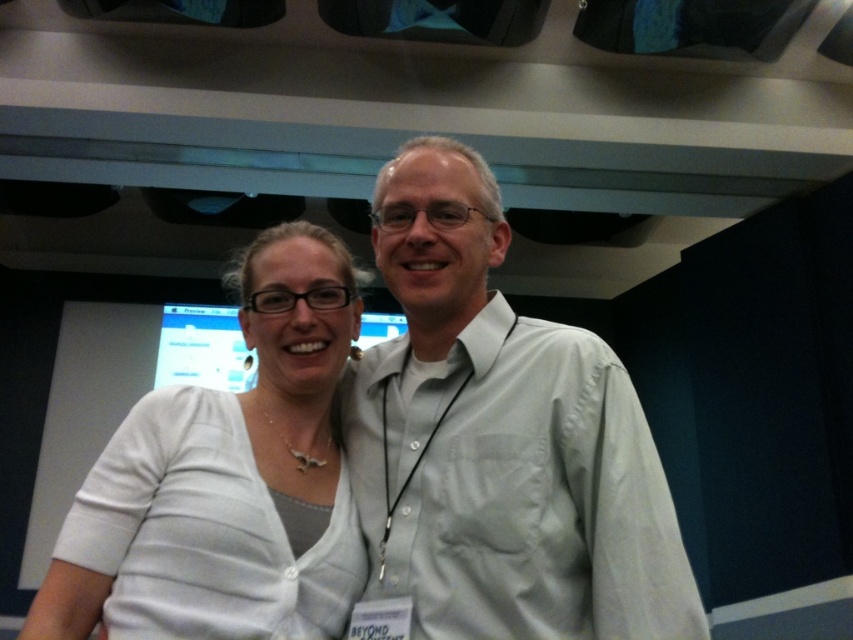
You are at a conference and want to approach the two people in the image. Since you need to speak to the person wearing the light gray shirt at center first, which direction should you move relative to the white matte shirt at center?

The light gray shirt at center is in front of the white matte shirt at center, so you should move forward towards the light gray shirt at center.

You are a photographer at an event and need to capture a photo of both the light gray shirt at center and the white matte shirt at center. The camera has a minimum focus distance of 9 inches. Can you take a photo of both shirts at the same time without moving either?

The light gray shirt at center is 8.91 inches from the white matte shirt at center, which is less than the camera minimum focus distance of 9 inches. Therefore, the camera cannot focus on both shirts simultaneously.

You are standing at the back of the room and want to take a photo of the two people in the image. Which point, point (395, 529) or point (347, 512), is closer to the camera?

Point (395, 529) is closer to the camera than point (347, 512) because it is in front of the other point.